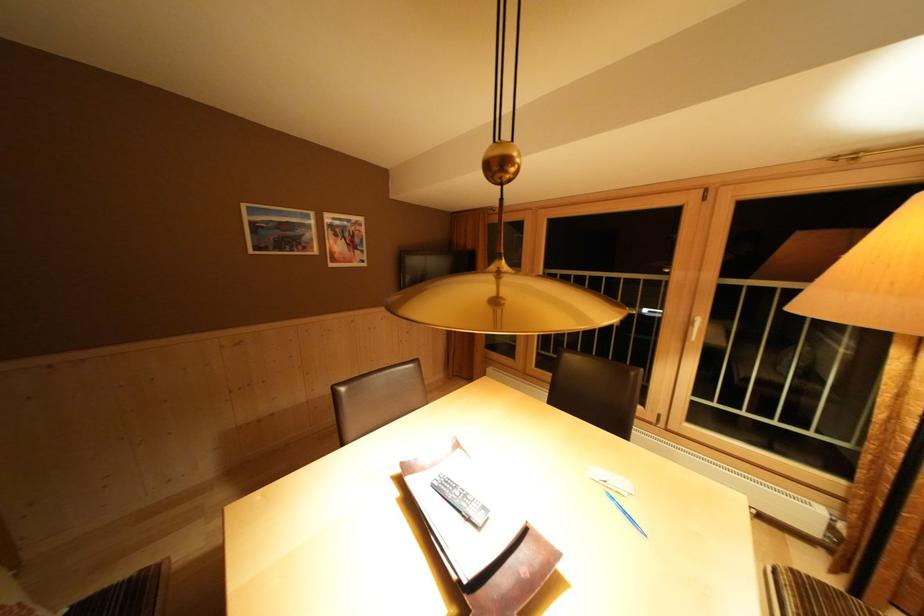
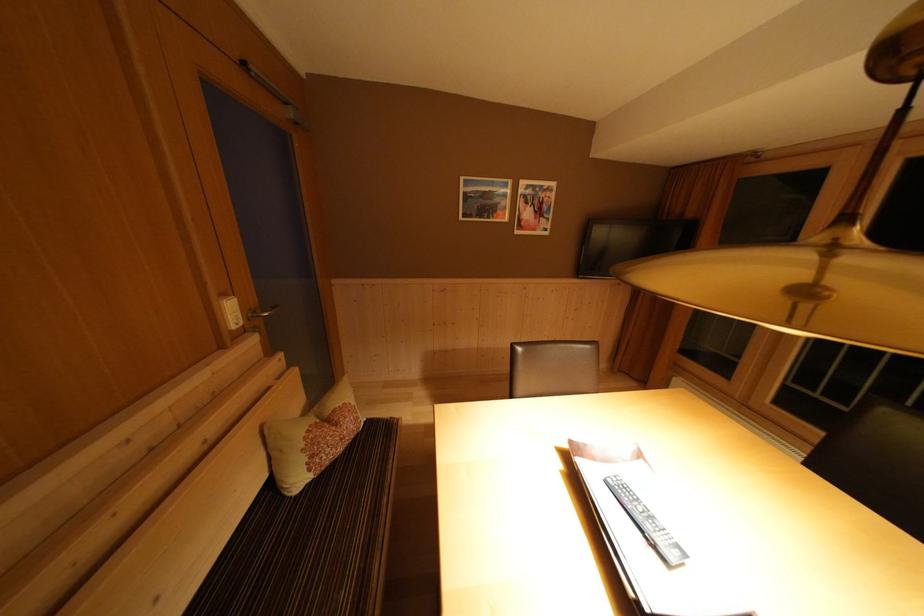
Question: I am providing you with two images of the same scene from different viewpoints. After the viewpoint changes to image2, which objects are now occluded?

Choices:
 (A) silver door handle
 (B) patterned pillow
 (C) white wall controller
 (D) none of these

Answer: (D)